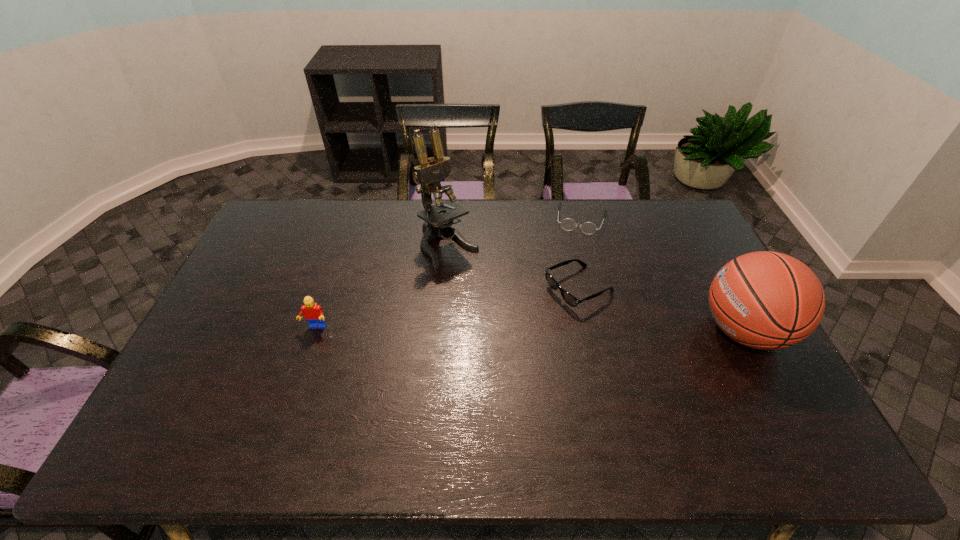
Locate an element on the screen. This screenshot has width=960, height=540. vacant point located between the Lego and the shorter spectacles is located at coordinates (448, 273).

Find the location of a particular element. The width and height of the screenshot is (960, 540). object that is the closest to the nearer spectacles is located at coordinates (567, 224).

What are the coordinates of `the closest object relative to the shortest object` in the screenshot? It's located at (568, 298).

The height and width of the screenshot is (540, 960). I want to click on blank area in the image that satisfies the following two spatial constraints: 1. on the front side of the basketball; 2. on the logo side of the nearer spectacles, so click(x=588, y=330).

Locate an element on the screen. This screenshot has width=960, height=540. blank space that satisfies the following two spatial constraints: 1. on the front-facing side of the third shortest object; 2. on the logo side of the second tallest object is located at coordinates (315, 330).